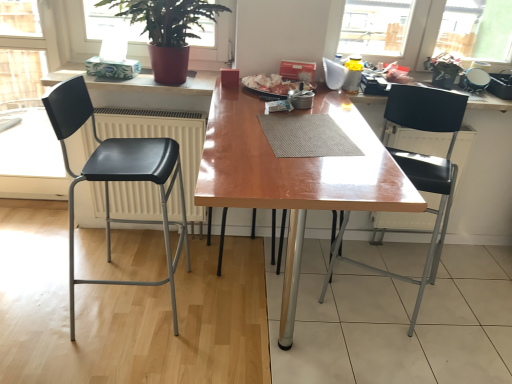
I want to click on vacant space that is in between wooden table at center and black plastic chair at right, marked as the 1th chair in a right-to-left arrangement, so click(387, 332).